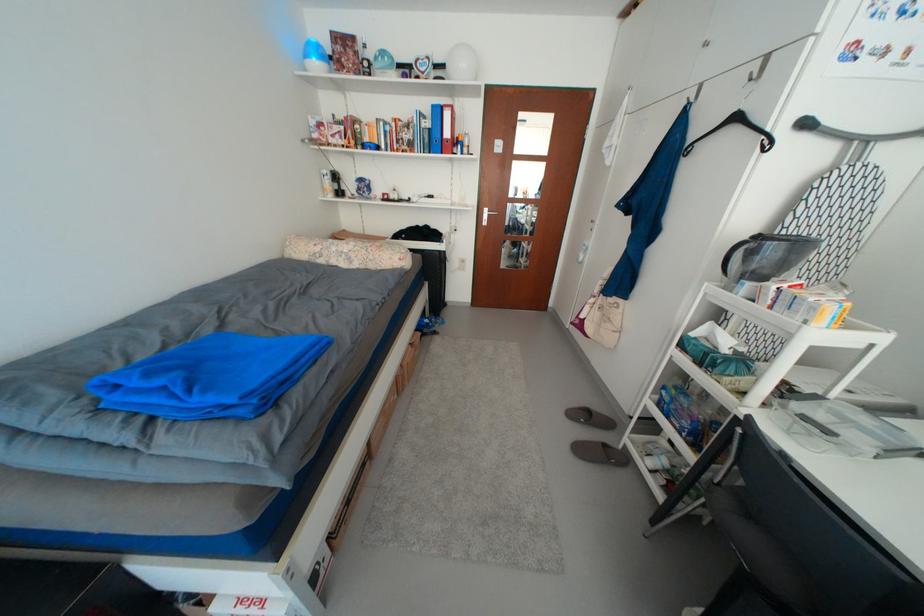
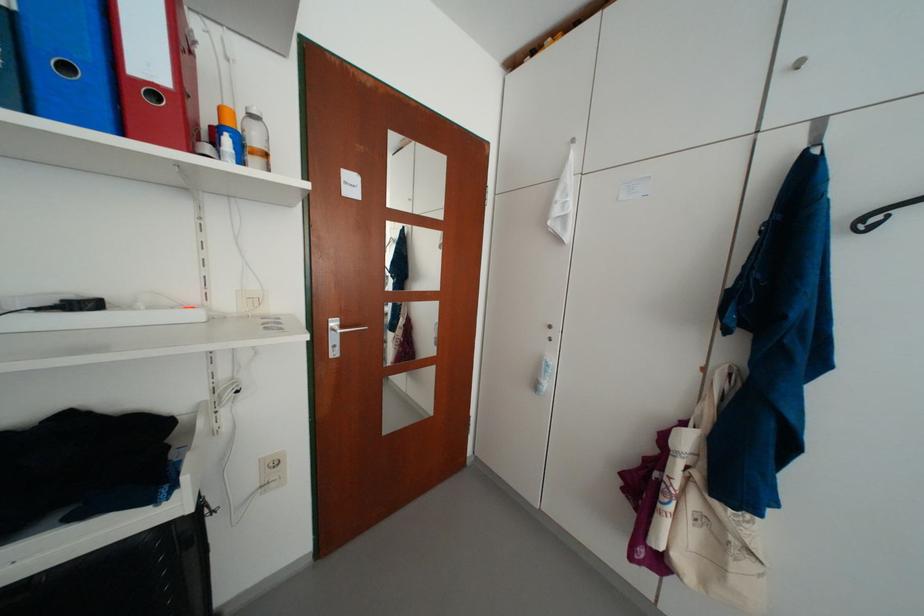
Locate, in the second image, the point that corresponds to pixel 468 148 in the first image.

(236, 143)